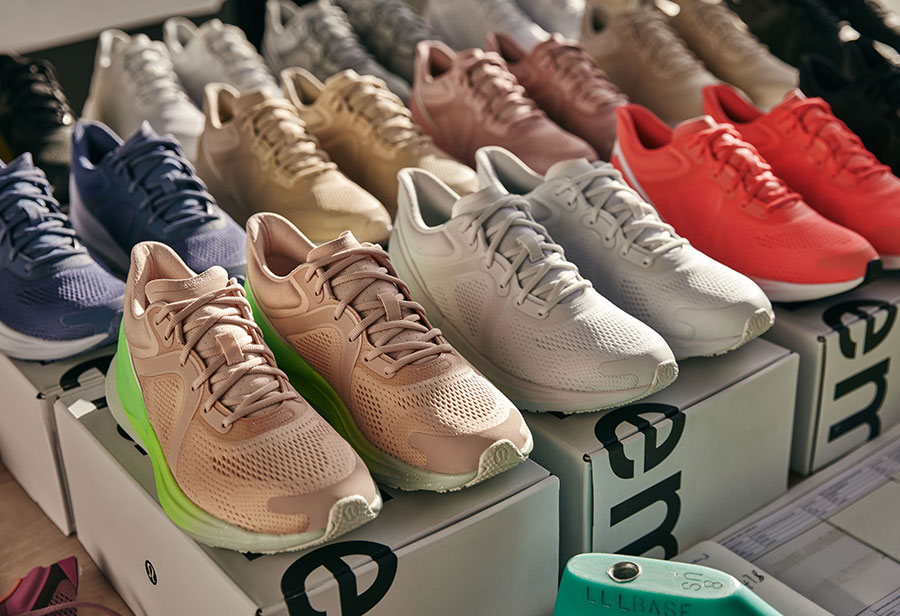
You are a GUI agent. You are given a task and a screenshot of the screen. Output one action in this format:
    pyautogui.click(x=<x>, y=<y>)
    Task: Click on the shoe box
    The width and height of the screenshot is (900, 616).
    Given the screenshot: What is the action you would take?
    pyautogui.click(x=454, y=564), pyautogui.click(x=653, y=445), pyautogui.click(x=868, y=358), pyautogui.click(x=68, y=371)